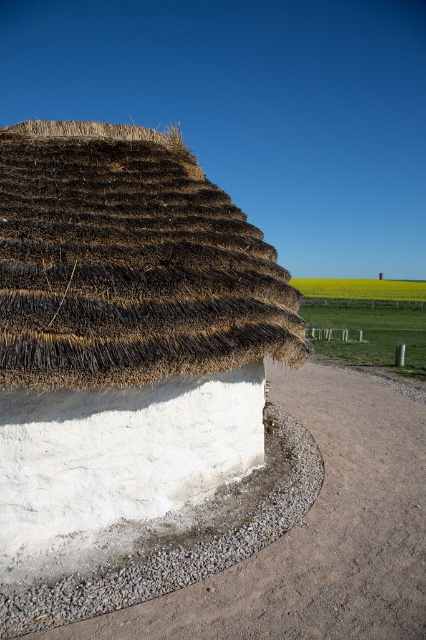
Is thatched straw hut at center to the right of gray gravel at lower center from the viewer's perspective?

No, thatched straw hut at center is not to the right of gray gravel at lower center.

Identify the location of thatched straw hut at center. (124, 337).

Between point (181, 378) and point (287, 484), which one is positioned behind?

The point (287, 484) is more distant.

Image resolution: width=426 pixels, height=640 pixels. Find the location of `thatched straw hut at center`. thatched straw hut at center is located at coordinates (124, 337).